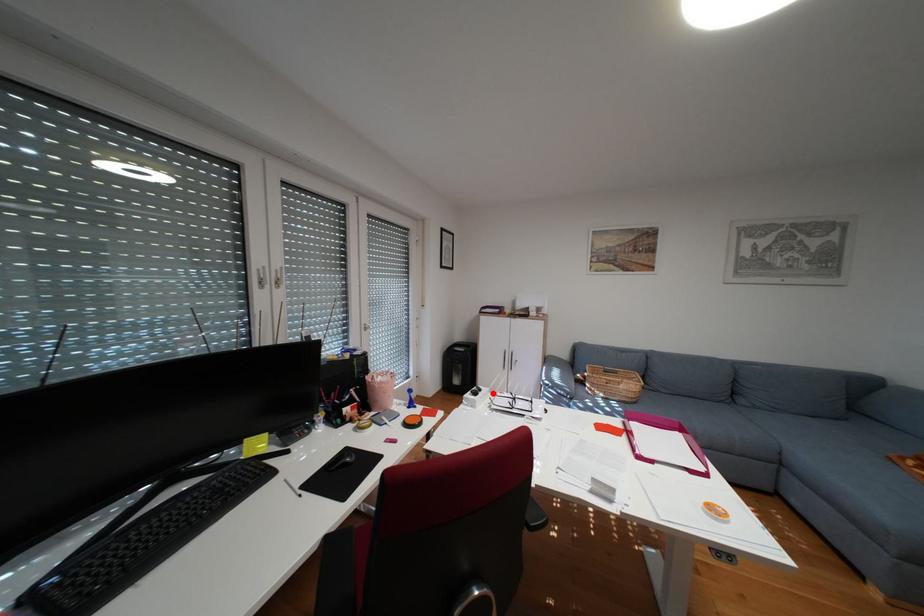
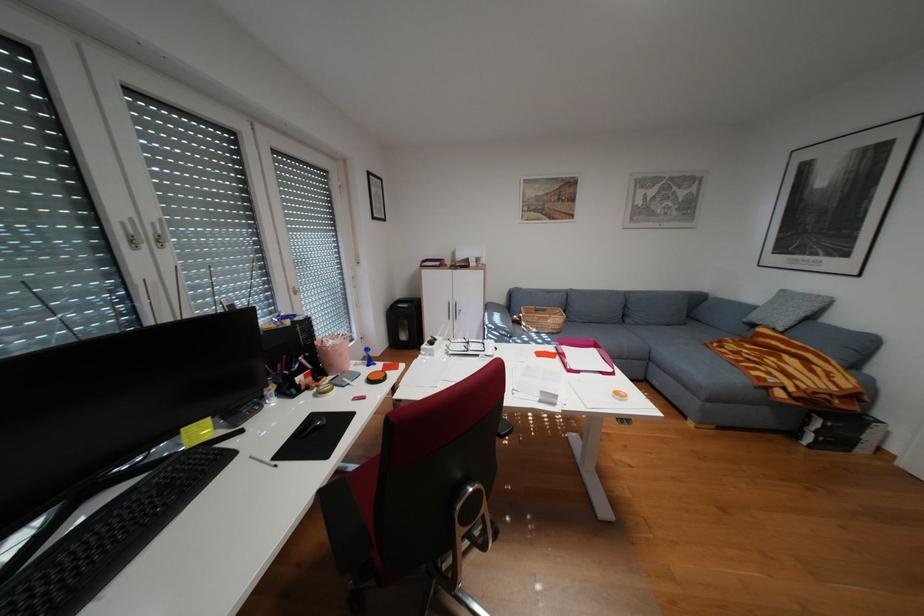
Locate, in the second image, the point that corresponds to the highlighted location in the first image.

(448, 342)